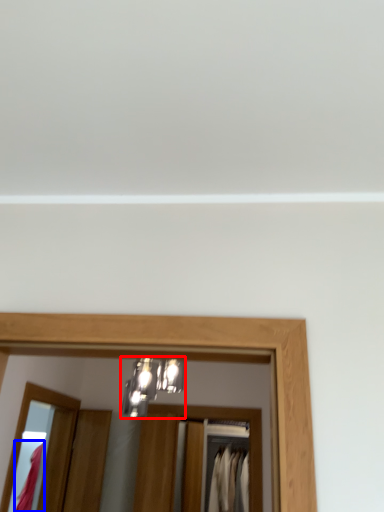
Question: Which object is closer to the camera taking this photo, light fixture (highlighted by a red box) or clothing (highlighted by a blue box)?

Choices:
 (A) light fixture
 (B) clothing

Answer: (A)